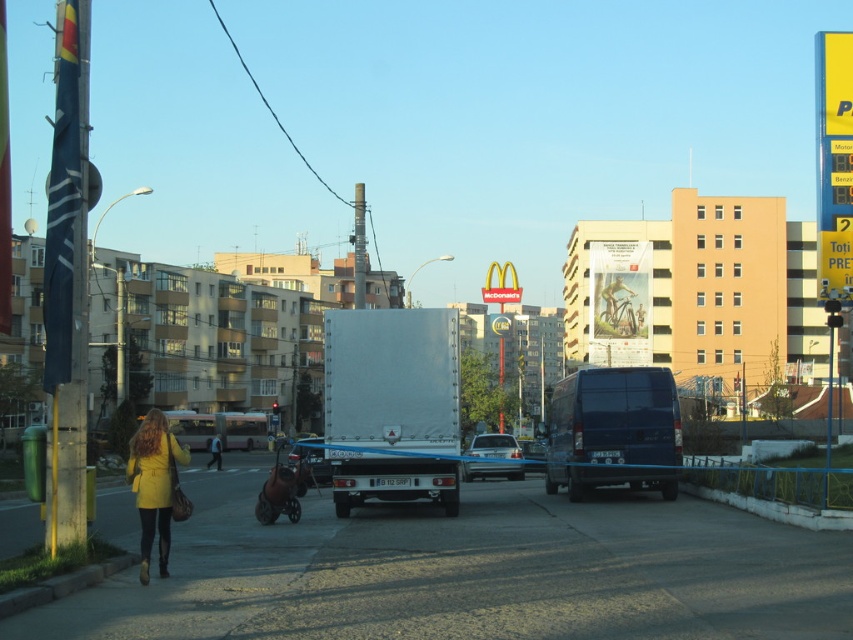
You are a pedestrian standing on the sidewalk and see the yellow matte coat at lower left and the yellow matte jacket at lower left. Which one is closer to you?

The yellow matte coat at lower left is closer to you because it is in front of the yellow matte jacket at lower left.

You are a delivery person trying to park your blue metallic car at center in a parking spot that can only accommodate vehicles shorter than the metallic silver car at center. Can your car fit in the spot?

The blue metallic car at center is not as tall as metallic silver car at center, so it will fit in the parking spot since it is shorter than the required height.

You are a pedestrian on the sidewalk and want to cross the road to reach the utility pole with the flag. There are two vehicles in the road, a dark blue van at center and a blue metallic car at center. Which vehicle should you avoid walking behind to stay safe?

You should avoid walking behind the dark blue van at center because it is in front of the blue metallic car at center, meaning it is closer to you and could move forward unexpectedly.